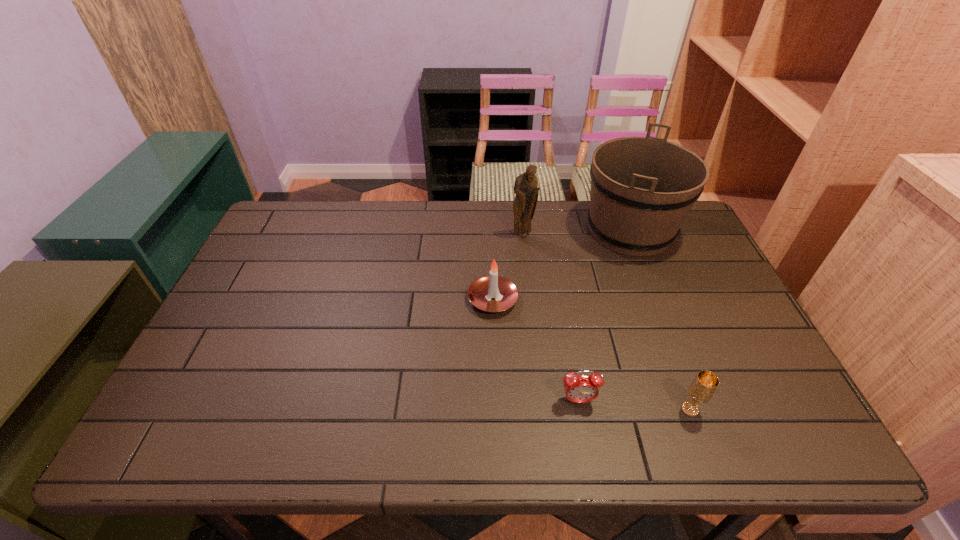
The width and height of the screenshot is (960, 540). I want to click on bucket, so click(x=642, y=188).

At what (x,y) coordinates should I click in order to perform the action: click on figurine. Please return your answer as a coordinate pair (x, y). This screenshot has width=960, height=540. Looking at the image, I should click on (526, 189).

Identify the location of candle. (493, 293).

Locate an element on the screen. the third nearest object is located at coordinates (493, 293).

In order to click on chalice in this screenshot , I will do click(701, 390).

This screenshot has width=960, height=540. Identify the location of the third object from right to left. (578, 388).

Where is `vacant space located on the front of the bucket`? vacant space located on the front of the bucket is located at coordinates (678, 352).

The width and height of the screenshot is (960, 540). I want to click on free space located 0.180m on the front-facing side of the figurine, so [x=527, y=278].

Find the location of a particular element. Image resolution: width=960 pixels, height=540 pixels. vacant space located 0.360m on the left of the third shortest object is located at coordinates (340, 300).

Identify the location of free space located 0.150m on the left of the chalice. (613, 409).